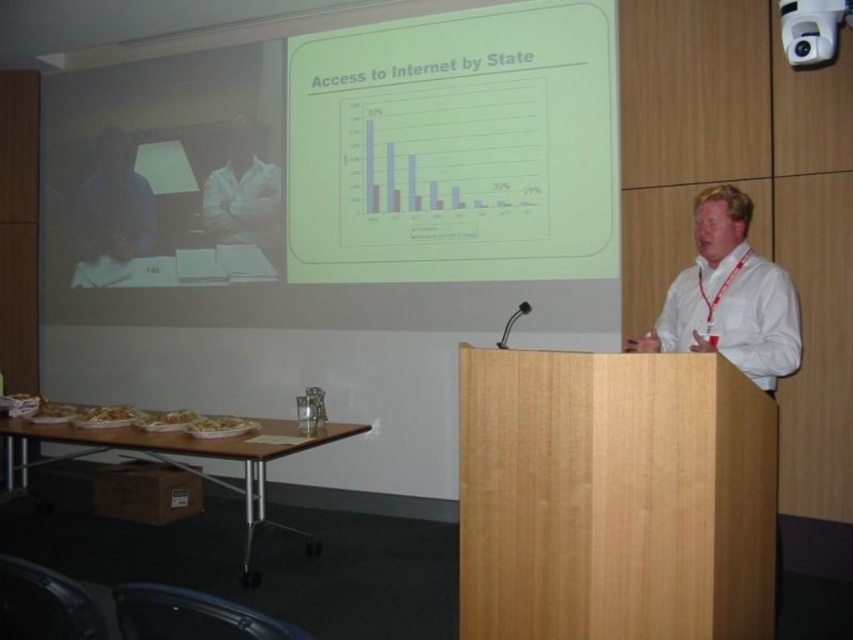
Measure the distance from white shirt at center to white glossy pasta at center.

They are 2.24 meters apart.

Is point (697, 236) closer to viewer compared to point (229, 435)?

That is True.

Measure the distance between white shirt at center and camera.

2.39 meters

Find the location of a particular element. This screenshot has width=853, height=640. white shirt at center is located at coordinates (729, 298).

Who is shorter, light brown wood podium at center or wooden podium at lower left?

With less height is wooden podium at lower left.

Is point (486, 424) behind point (96, 445)?

No, (486, 424) is closer to viewer.

In order to click on light brown wood podium at center in this screenshot , I will do `click(614, 497)`.

Who is positioned more to the left, wooden podium at lower left or white shirt at upper center?

white shirt at upper center is more to the left.

Is wooden podium at lower left wider than white shirt at upper center?

Indeed, wooden podium at lower left has a greater width compared to white shirt at upper center.

Who is more distant from viewer, (341, 433) or (225, 205)?

The point (225, 205) is behind.

Image resolution: width=853 pixels, height=640 pixels. Identify the location of wooden podium at lower left. (180, 461).